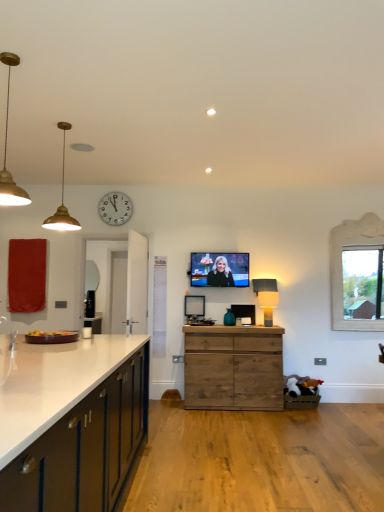
Question: Is wooden picture frame at center, placed as the second picture frame when sorted from top to bottom, situated inside white wooden clock at upper center or outside?

Choices:
 (A) outside
 (B) inside

Answer: (A)

Question: Is wooden picture frame at center, placed as the second picture frame when sorted from top to bottom, wider or thinner than white wooden clock at upper center?

Choices:
 (A) thin
 (B) wide

Answer: (B)

Question: Based on their relative distances, which object is farther from the white glossy cabinet at left, the 1th cabinetry positioned from the left?

Choices:
 (A) matte silver mirror at left
 (B) matte black lamp at center, the third lamp positioned from the left
 (C) white carved wood window at right
 (D) matte black tv at center, which is counted as the third picture frame, starting from the bottom
 (E) white wooden clock at upper center

Answer: (C)

Question: Based on their relative distances, which object is nearer to the matte black picture frame at center, which ranks as the 3th picture frame in top-to-bottom order?

Choices:
 (A) matte black lamp at center, the first lamp positioned from the bottom
 (B) gold metallic pendant light at left, which is counted as the 1th lamp, starting from the front
 (C) white glossy cabinet at left, the 1th cabinetry positioned from the left
 (D) white carved wood window at right
 (E) white wooden clock at upper center

Answer: (A)